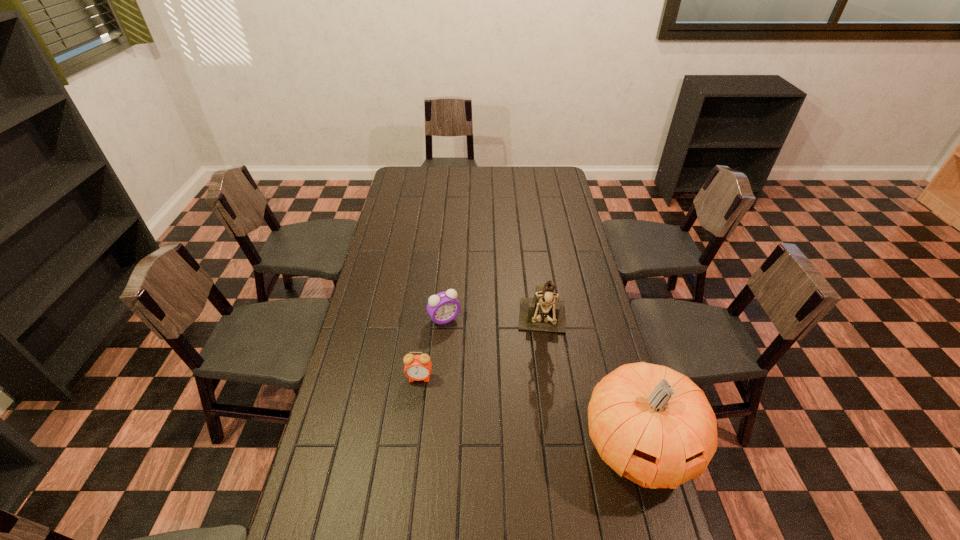
Image resolution: width=960 pixels, height=540 pixels. Find the location of `free spot between the pumpkin and the figurine`. free spot between the pumpkin and the figurine is located at coordinates (590, 386).

Image resolution: width=960 pixels, height=540 pixels. In order to click on object that ranks as the third closest to the farther alarm clock in this screenshot , I will do `click(649, 422)`.

What are the coordinates of `the second closest object to the nearest object` in the screenshot? It's located at tap(417, 367).